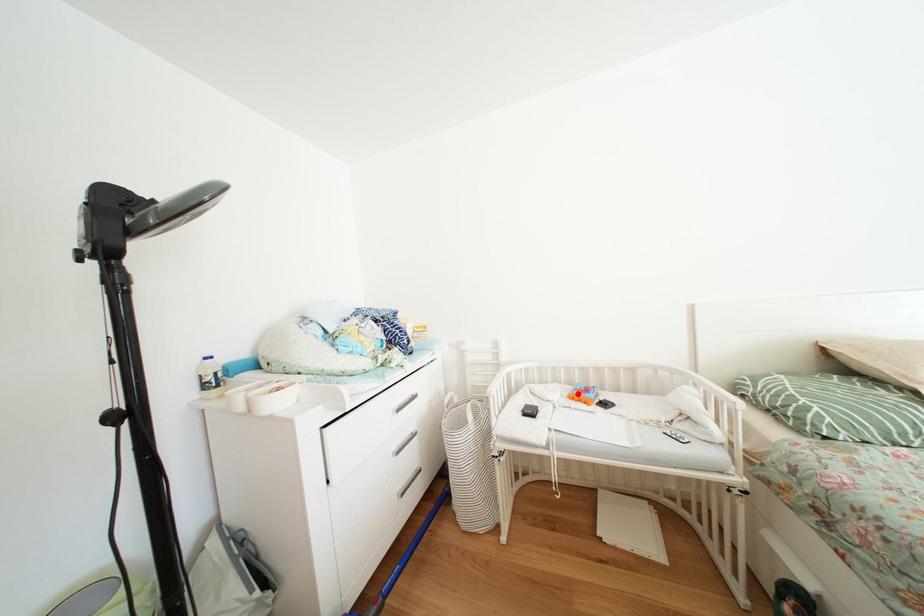
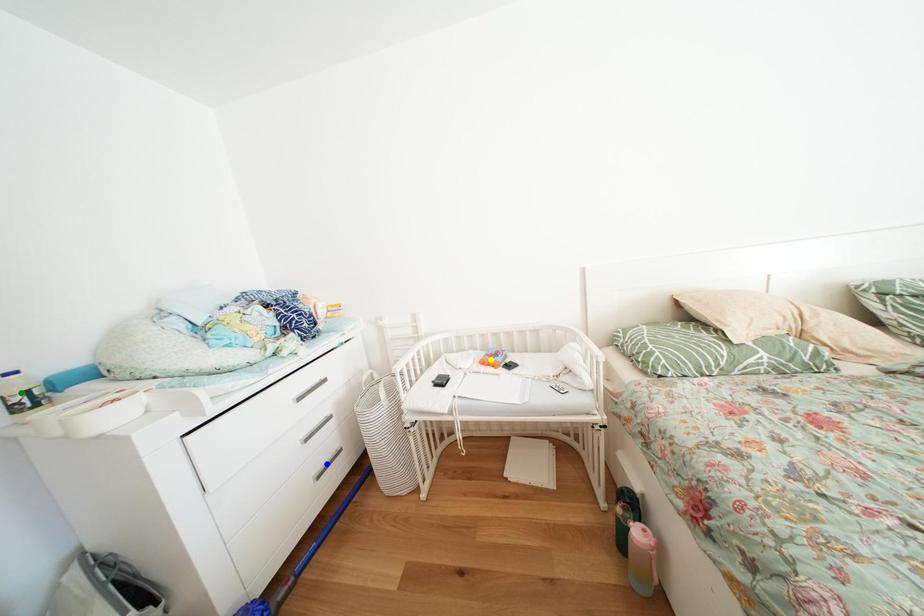
Question: I am providing you with two images of the same scene from different viewpoints. A red point is marked on the first image. You are given multiple points on the second image. Which point in image 2 is actually the same real-world point as the red point in image 1?

Choices:
 (A) blue point
 (B) yellow point
 (C) green point

Answer: (B)